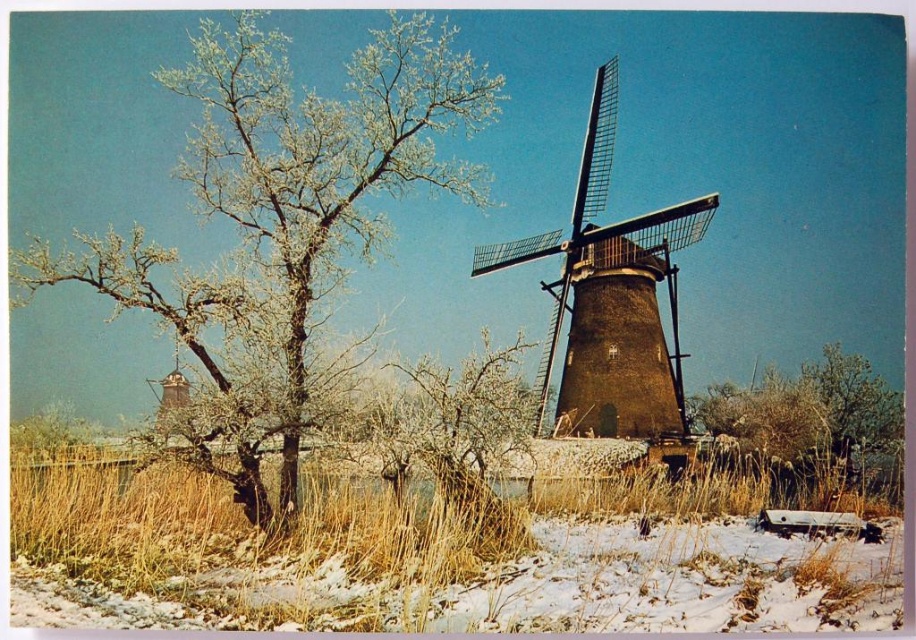
Question: Which of the following is the closest to the observer?

Choices:
 (A) (225, 410)
 (B) (591, 150)

Answer: (A)

Question: Is brown textured windmill at center wider than brown textured bush at lower right?

Choices:
 (A) yes
 (B) no

Answer: (A)

Question: Which of the following is the farthest from the observer?

Choices:
 (A) (793, 410)
 (B) (266, 97)

Answer: (A)

Question: Observing the image, what is the correct spatial positioning of white frosty branches at upper left in reference to brown textured windmill at center?

Choices:
 (A) below
 (B) above

Answer: (B)

Question: Which point is farther to the camera?

Choices:
 (A) (350, 77)
 (B) (773, 428)
 (C) (613, 221)

Answer: (C)

Question: Is brown textured windmill at center to the right of brown textured bush at lower right from the viewer's perspective?

Choices:
 (A) yes
 (B) no

Answer: (B)